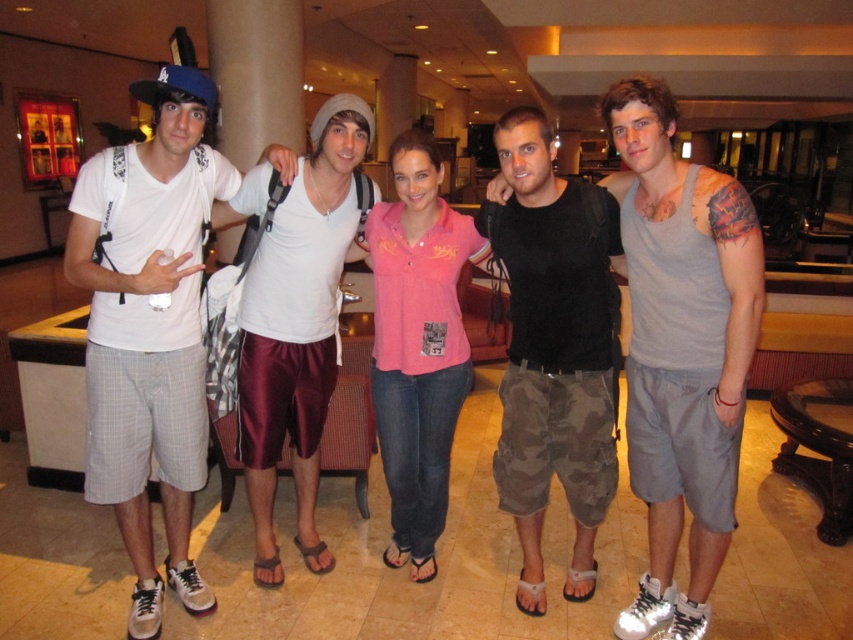
Question: Does black cotton t-shirt at center have a greater width compared to pink fabric shirt at center?

Choices:
 (A) no
 (B) yes

Answer: (A)

Question: Which point appears closest to the camera in this image?

Choices:
 (A) (293, 465)
 (B) (189, 502)
 (C) (421, 179)
 (D) (506, 458)

Answer: (C)

Question: Which of the following is the closest to the observer?

Choices:
 (A) (260, 176)
 (B) (438, 419)

Answer: (A)

Question: Which object appears closest to the camera in this image?

Choices:
 (A) black cotton t-shirt at center
 (B) gray tank top at center
 (C) white cotton t-shirt at left

Answer: (B)

Question: Does black cotton t-shirt at center lie behind pink fabric shirt at center?

Choices:
 (A) no
 (B) yes

Answer: (A)

Question: Where is gray tank top at center located in relation to black cotton t-shirt at center in the image?

Choices:
 (A) below
 (B) above

Answer: (B)